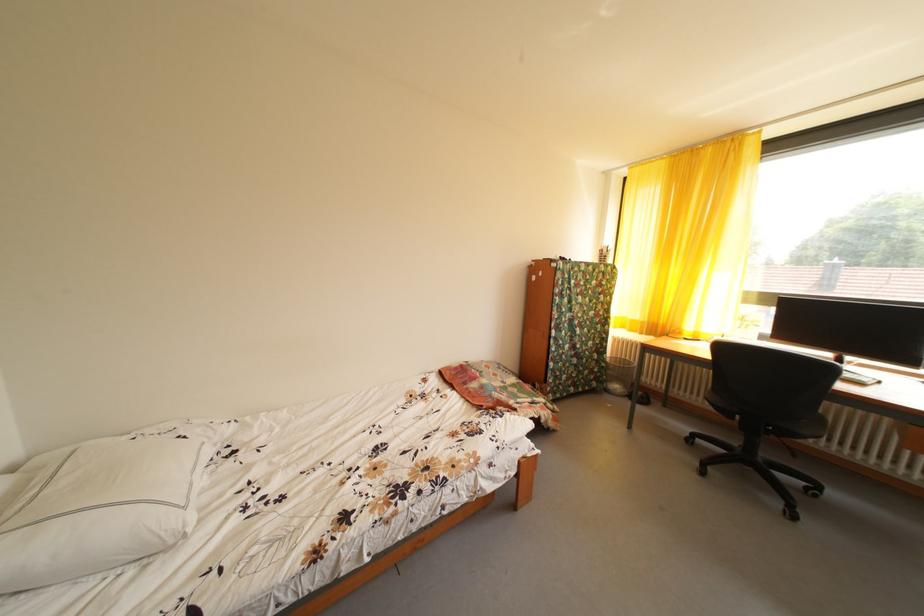
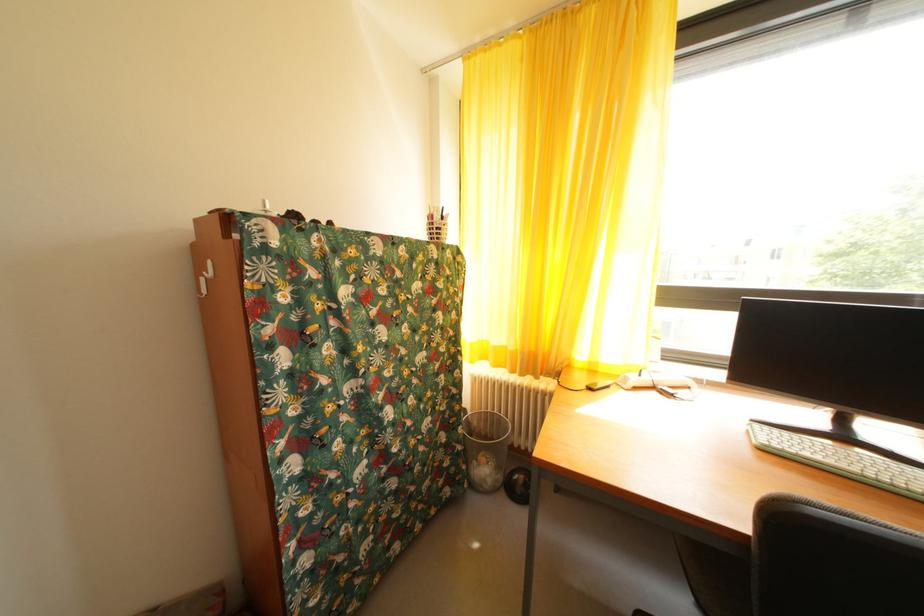
In the second image, find the point that corresponds to pixel 640 326 in the first image.

(505, 354)